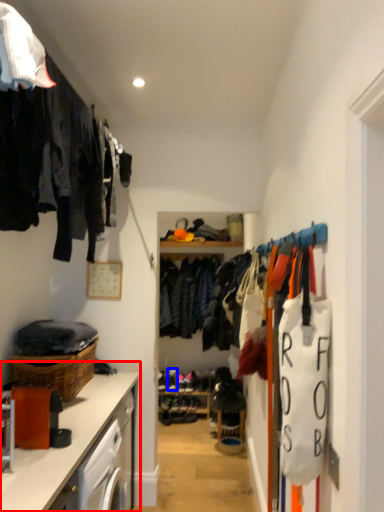
Question: Which of the following is the closest to the observer, countertop (highlighted by a red box) or shoe (highlighted by a blue box)?

Choices:
 (A) countertop
 (B) shoe

Answer: (A)